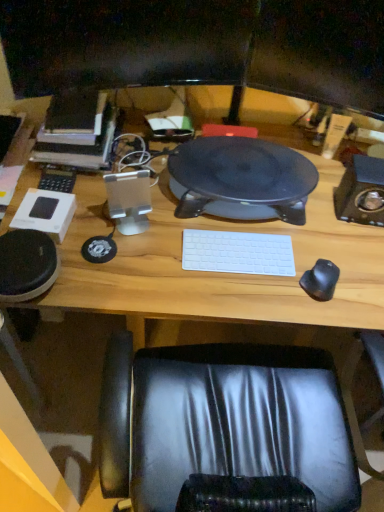
Question: Is black glossy monitor at upper center, acting as the 1th computer monitor starting from the left, oriented towards hardcover book at left?

Choices:
 (A) no
 (B) yes

Answer: (A)

Question: Is black glossy monitor at upper center, acting as the 1th computer monitor starting from the left, in contact with hardcover book at left?

Choices:
 (A) no
 (B) yes

Answer: (A)

Question: Considering the relative sizes of black glossy monitor at upper center, marked as the second computer monitor in a right-to-left arrangement, and hardcover book at left in the image provided, is black glossy monitor at upper center, marked as the second computer monitor in a right-to-left arrangement, smaller than hardcover book at left?

Choices:
 (A) no
 (B) yes

Answer: (B)

Question: Is black glossy monitor at upper center, acting as the 1th computer monitor starting from the left, to the right of hardcover book at left from the viewer's perspective?

Choices:
 (A) yes
 (B) no

Answer: (A)

Question: Is black glossy monitor at upper center, marked as the second computer monitor in a right-to-left arrangement, wider than hardcover book at left?

Choices:
 (A) yes
 (B) no

Answer: (B)

Question: Is black plastic speaker at center bigger or smaller than matte black monitor at upper center, marked as the 2th computer monitor in a left-to-right arrangement?

Choices:
 (A) big
 (B) small

Answer: (A)

Question: From the image's perspective, is black plastic speaker at center above or below matte black monitor at upper center, marked as the 2th computer monitor in a left-to-right arrangement?

Choices:
 (A) above
 (B) below

Answer: (B)

Question: Considering their positions, is black plastic speaker at center located in front of or behind matte black monitor at upper center, marked as the 2th computer monitor in a left-to-right arrangement?

Choices:
 (A) behind
 (B) front

Answer: (A)

Question: Is black plastic speaker at center inside the boundaries of matte black monitor at upper center, which ranks as the first computer monitor in right-to-left order, or outside?

Choices:
 (A) inside
 (B) outside

Answer: (B)

Question: Is hardcover book at left in front of or behind black plastic speaker at center in the image?

Choices:
 (A) behind
 (B) front

Answer: (A)

Question: From a real-world perspective, is hardcover book at left positioned above or below black plastic speaker at center?

Choices:
 (A) above
 (B) below

Answer: (A)

Question: Would you say hardcover book at left is inside or outside black plastic speaker at center?

Choices:
 (A) outside
 (B) inside

Answer: (A)

Question: From the image's perspective, is hardcover book at left positioned above or below black plastic speaker at center?

Choices:
 (A) below
 (B) above

Answer: (B)

Question: Do you think wooden computer desk at center is within black rubber mouse at right, or outside of it?

Choices:
 (A) inside
 (B) outside

Answer: (B)

Question: Is point (117, 310) closer or farther from the camera than point (322, 291)?

Choices:
 (A) closer
 (B) farther

Answer: (A)